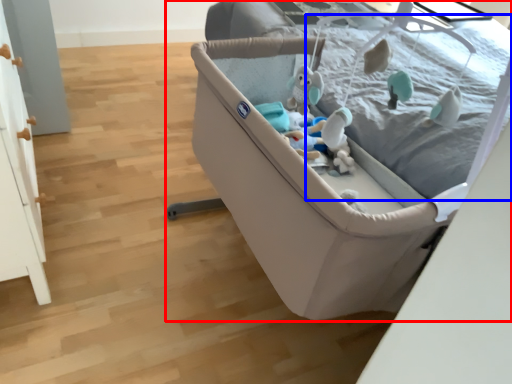
Question: Which point is closer to the camera, infant bed (highlighted by a red box) or mattress (highlighted by a blue box)?

Choices:
 (A) infant bed
 (B) mattress

Answer: (B)